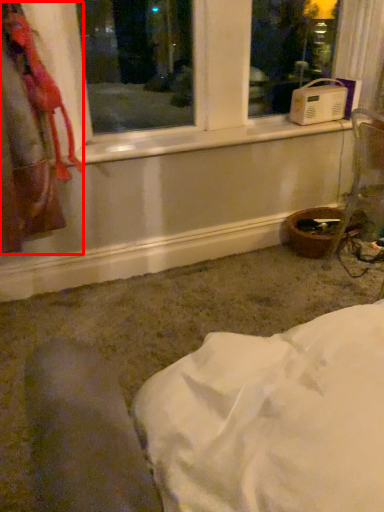
Question: From the image's perspective, where is laundry (annotated by the red box) located relative to bay window?

Choices:
 (A) above
 (B) below

Answer: (B)